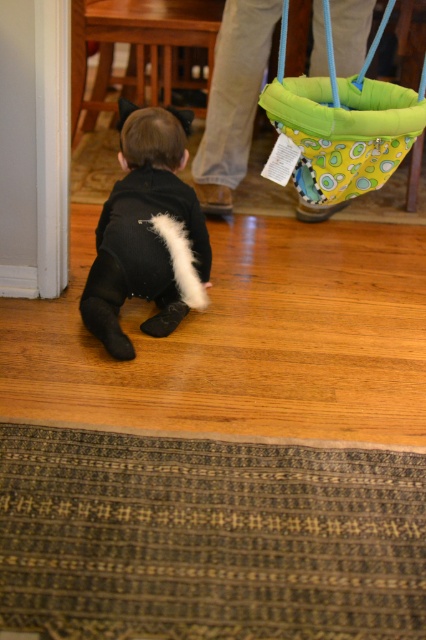
Can you confirm if black soft plush at center is wider than green fabric hammock at upper right?

In fact, black soft plush at center might be narrower than green fabric hammock at upper right.

Between black soft plush at center and green fabric hammock at upper right, which one is positioned lower?

black soft plush at center

Describe the element at coordinates (147, 232) in the screenshot. I see `black soft plush at center` at that location.

The width and height of the screenshot is (426, 640). Identify the location of black soft plush at center. (147, 232).